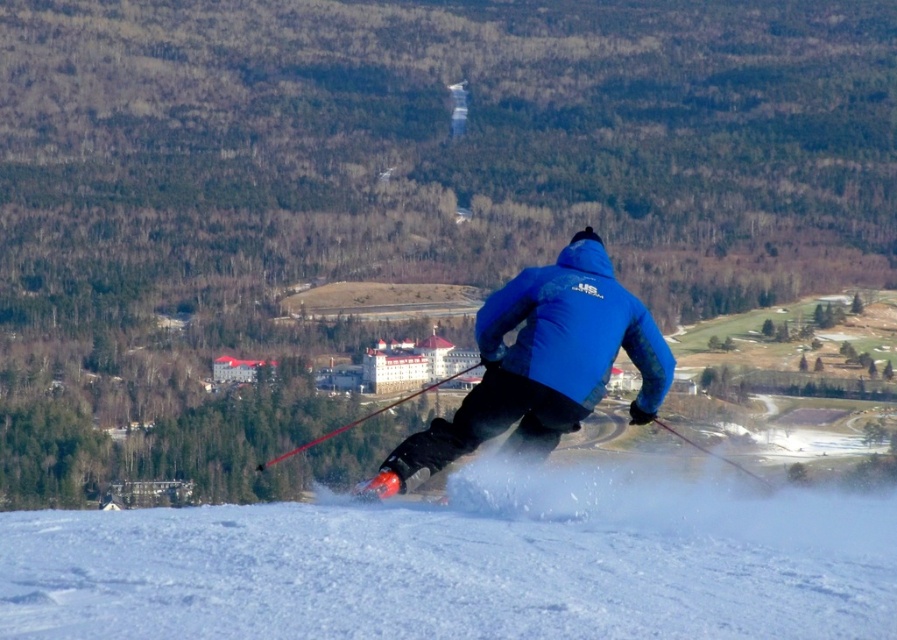
Who is more forward, (538, 394) or (555, 371)?

Point (538, 394) is more forward.

Is blue matte jacket at center shorter than blue softshell jacket at center?

No.

Is point (550, 342) in front of point (597, 284)?

Yes, point (550, 342) is closer to viewer.

The image size is (897, 640). I want to click on blue matte jacket at center, so click(x=542, y=364).

Can you confirm if white powdery snow at center is positioned below blue matte jacket at center?

Yes, white powdery snow at center is below blue matte jacket at center.

Who is positioned more to the right, white powdery snow at center or blue matte jacket at center?

blue matte jacket at center is more to the right.

Which is behind, point (312, 525) or point (655, 340)?

The point (655, 340) is behind.

Image resolution: width=897 pixels, height=640 pixels. I want to click on white powdery snow at center, so click(453, 572).

Can you confirm if white powdery snow at center is positioned above blue softshell jacket at center?

Actually, white powdery snow at center is below blue softshell jacket at center.

Can you confirm if white powdery snow at center is positioned to the left of blue softshell jacket at center?

Indeed, white powdery snow at center is positioned on the left side of blue softshell jacket at center.

Does point (159, 518) come in front of point (541, 307)?

Yes, it is.

The image size is (897, 640). Identify the location of white powdery snow at center. (453, 572).